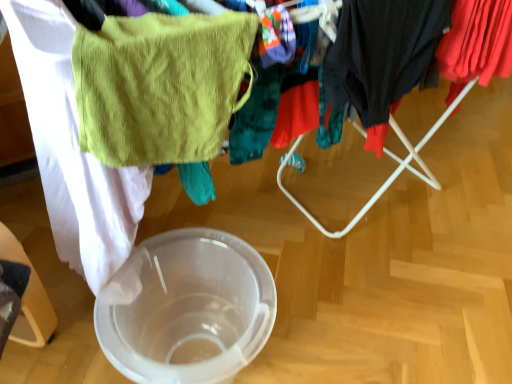
Question: Can you confirm if transparent plastic bowl at center is shorter than green terry cloth towel at upper left?

Choices:
 (A) yes
 (B) no

Answer: (B)

Question: Does transparent plastic bowl at center appear on the left side of green terry cloth towel at upper left?

Choices:
 (A) no
 (B) yes

Answer: (B)

Question: Does transparent plastic bowl at center contain green terry cloth towel at upper left?

Choices:
 (A) no
 (B) yes

Answer: (A)

Question: Is transparent plastic bowl at center to the right of green terry cloth towel at upper left from the viewer's perspective?

Choices:
 (A) yes
 (B) no

Answer: (B)

Question: From the image's perspective, is transparent plastic bowl at center located beneath green terry cloth towel at upper left?

Choices:
 (A) yes
 (B) no

Answer: (A)

Question: From a real-world perspective, is dark gray fabric at right, the first clothing from the left, positioned above or below green terry cloth towel at upper left?

Choices:
 (A) above
 (B) below

Answer: (B)

Question: From the image's perspective, is dark gray fabric at right, the second clothing viewed from the right, positioned above or below green terry cloth towel at upper left?

Choices:
 (A) above
 (B) below

Answer: (A)

Question: In terms of height, does dark gray fabric at right, the first clothing from the left, look taller or shorter compared to green terry cloth towel at upper left?

Choices:
 (A) short
 (B) tall

Answer: (B)

Question: Is dark gray fabric at right, the second clothing viewed from the right, inside or outside of green terry cloth towel at upper left?

Choices:
 (A) outside
 (B) inside

Answer: (A)

Question: Considering the positions of point (463, 18) and point (181, 294), is point (463, 18) closer or farther from the camera than point (181, 294)?

Choices:
 (A) farther
 (B) closer

Answer: (B)

Question: Is red cotton shirt at upper right, arranged as the 2th clothing when viewed from the left, wider or thinner than transparent plastic bowl at center?

Choices:
 (A) wide
 (B) thin

Answer: (B)

Question: Is red cotton shirt at upper right, arranged as the 2th clothing when viewed from the left, situated inside transparent plastic bowl at center or outside?

Choices:
 (A) inside
 (B) outside

Answer: (B)

Question: From the image's perspective, is red cotton shirt at upper right, arranged as the first clothing when viewed from the right, positioned above or below transparent plastic bowl at center?

Choices:
 (A) above
 (B) below

Answer: (A)

Question: In terms of size, does dark gray fabric at right, the second clothing viewed from the right, appear bigger or smaller than transparent plastic bowl at center?

Choices:
 (A) big
 (B) small

Answer: (B)

Question: From the image's perspective, is dark gray fabric at right, the first clothing from the left, positioned above or below transparent plastic bowl at center?

Choices:
 (A) below
 (B) above

Answer: (B)